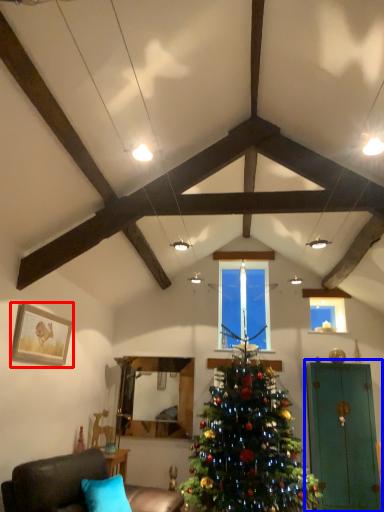
Question: Which of the following is the closest to the observer, picture frame (highlighted by a red box) or armoire (highlighted by a blue box)?

Choices:
 (A) picture frame
 (B) armoire

Answer: (A)